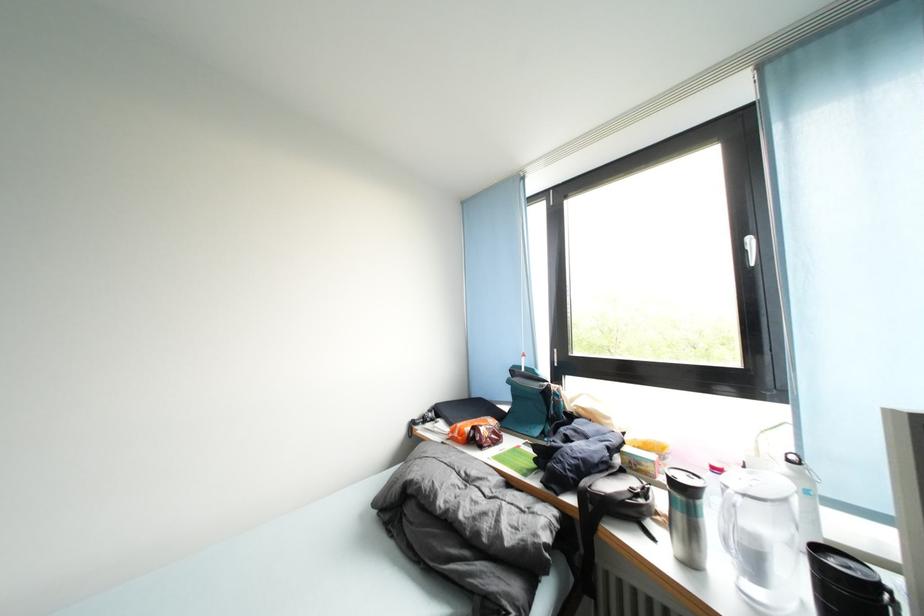
Where is `backpack top handle`? backpack top handle is located at coordinates (609, 512).